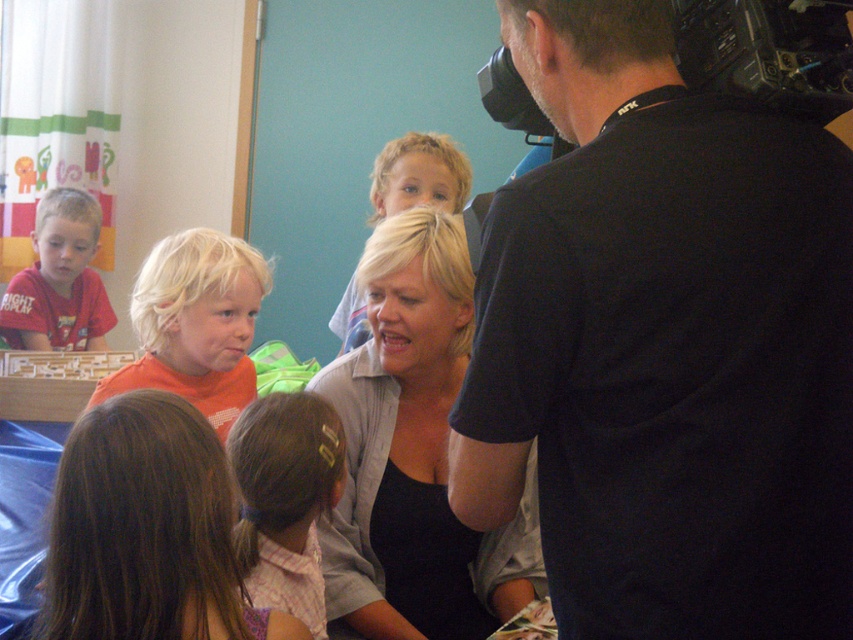
Based on the photo, you are a photographer in the classroom and you see the brown hair at lower left and the orange matte shirt at center. Which one is more to the left?

The orange matte shirt at center is more to the left because the brown hair at lower left is positioned on the right side of it.